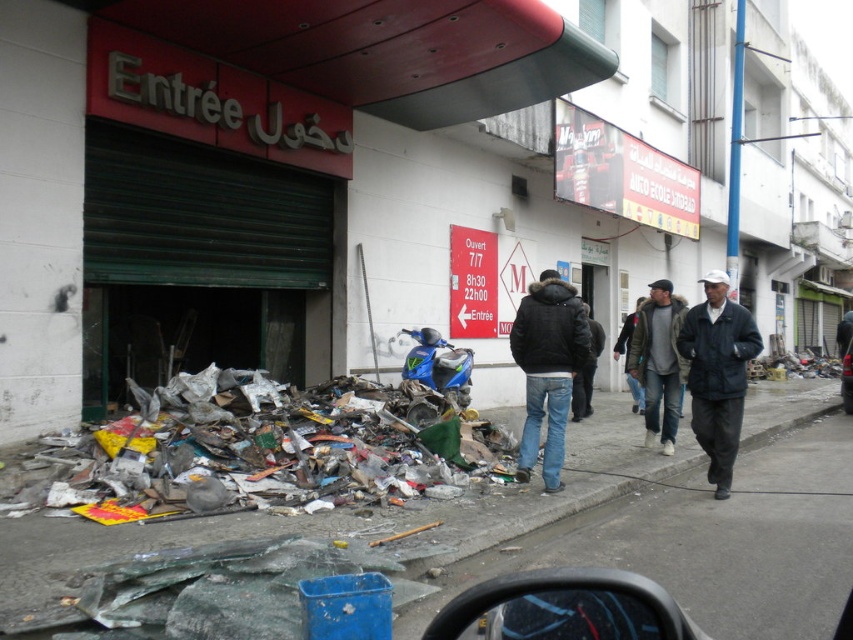
Does black matte jacket at center appear under dark blue jacket at right?

No, black matte jacket at center is not below dark blue jacket at right.

Is black matte jacket at center in front of dark blue jacket at right?

Yes, it is.

Who is more forward, (x=544, y=333) or (x=746, y=316)?

Point (x=544, y=333) is in front.

Identify the location of black matte jacket at center. (x=547, y=369).

Based on the photo, between shiny metallic trash at lower left and dark brown leather jacket at center, which one has less height?

shiny metallic trash at lower left is shorter.

Does shiny metallic trash at lower left appear over dark brown leather jacket at center?

Indeed, shiny metallic trash at lower left is positioned over dark brown leather jacket at center.

Locate an element on the screen. Image resolution: width=853 pixels, height=640 pixels. shiny metallic trash at lower left is located at coordinates (260, 448).

Does broken glass pavement at lower left have a greater height compared to metallic silver car at center?

Incorrect, broken glass pavement at lower left's height is not larger of metallic silver car at center's.

Is broken glass pavement at lower left positioned behind metallic silver car at center?

No.

Is point (604, 486) positioned after point (851, 369)?

No, (604, 486) is in front of (851, 369).

Find the location of `broken glass pavement at lower left`. broken glass pavement at lower left is located at coordinates (416, 506).